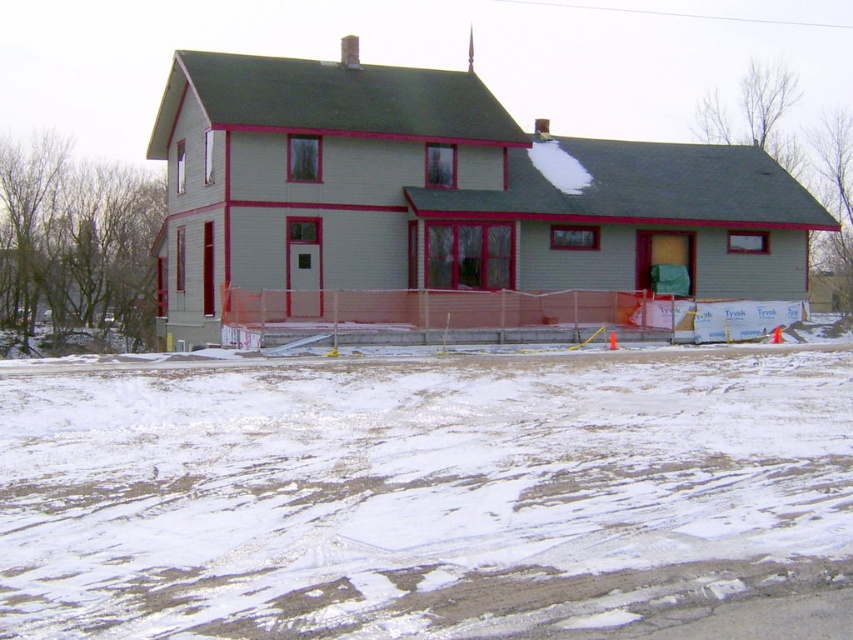
Question: From the image, what is the correct spatial relationship of white powdery snow at lower center in relation to light gray wood house at center?

Choices:
 (A) above
 (B) below

Answer: (B)

Question: Which point is closer to the camera?

Choices:
 (A) white powdery snow at lower center
 (B) light gray wood house at center

Answer: (A)

Question: Can you confirm if white powdery snow at lower center is positioned below light gray wood house at center?

Choices:
 (A) yes
 (B) no

Answer: (A)

Question: Which object appears closest to the camera in this image?

Choices:
 (A) light gray wood house at center
 (B) white powdery snow at lower center

Answer: (B)

Question: Among these points, which one is farthest from the camera?

Choices:
 (A) (645, 252)
 (B) (495, 365)

Answer: (A)

Question: Can you confirm if white powdery snow at lower center is bigger than light gray wood house at center?

Choices:
 (A) no
 (B) yes

Answer: (A)